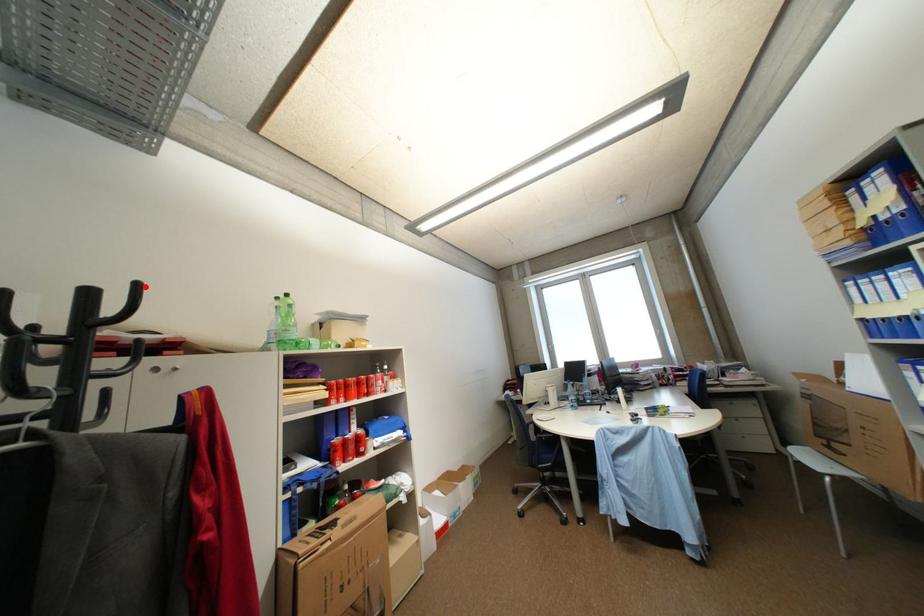
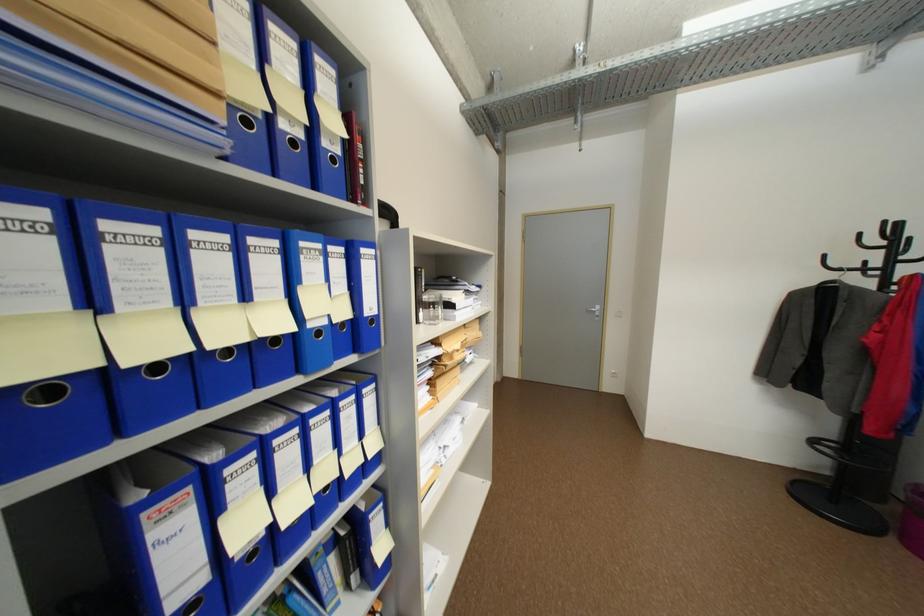
Locate, in the second image, the point that corresponds to the highlighted location in the first image.

(893, 224)